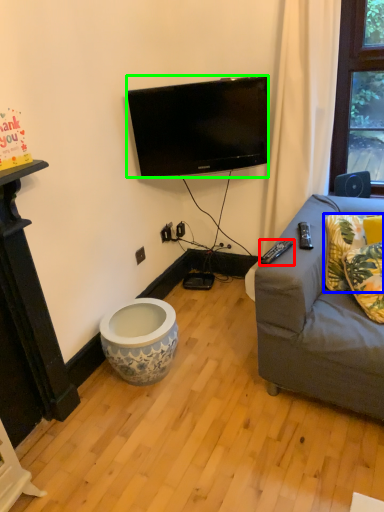
Question: Based on their relative distances, which object is farther from remote control (highlighted by a red box)? Choose from pillow (highlighted by a blue box) and television (highlighted by a green box).

Choices:
 (A) pillow
 (B) television

Answer: (B)